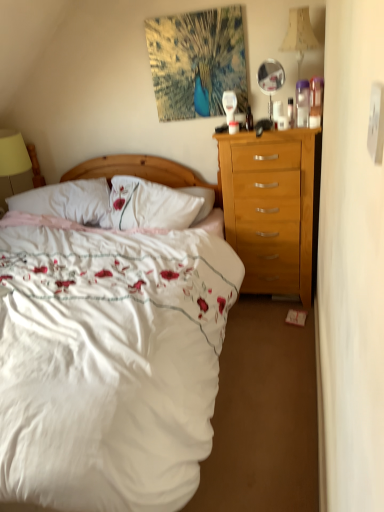
Question: Looking at their shapes, would you say matte white coffee cup at center is wider or thinner than white soft pillow at center?

Choices:
 (A) thin
 (B) wide

Answer: (A)

Question: Would you say matte white coffee cup at center is inside or outside white soft pillow at center?

Choices:
 (A) inside
 (B) outside

Answer: (B)

Question: Which object is positioned closest to the translucent plastic bottle at upper center, which is the 2th bottle in front-to-back order?

Choices:
 (A) clear plastic bottle at upper right, the second bottle from the left
 (B) wooden headboard at center
 (C) matte white coffee cup at center
 (D) white soft pillow at center
 (E) yellow fabric lampshade at left, marked as the second lamp in a front-to-back arrangement

Answer: (C)

Question: Estimate the real-world distances between objects in this image. Which object is farther from the white satin bed at center?

Choices:
 (A) clear glass mirror at upper right
 (B) clear plastic bottle at upper right, which is the 2th bottle in back-to-front order
 (C) translucent plastic bottle at upper center, which appears as the first bottle when viewed from the top
 (D) yellow fabric lampshade at left, the 1th lamp in the bottom-to-top sequence
 (E) wooden headboard at center

Answer: (B)